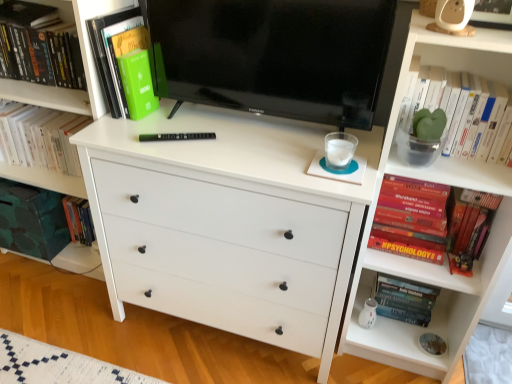
This screenshot has height=384, width=512. Find the location of `free space above green matte book at upper left, arranged as the fourth book when viewed from the right (from a real-world perspective)`. free space above green matte book at upper left, arranged as the fourth book when viewed from the right (from a real-world perspective) is located at coordinates (116, 15).